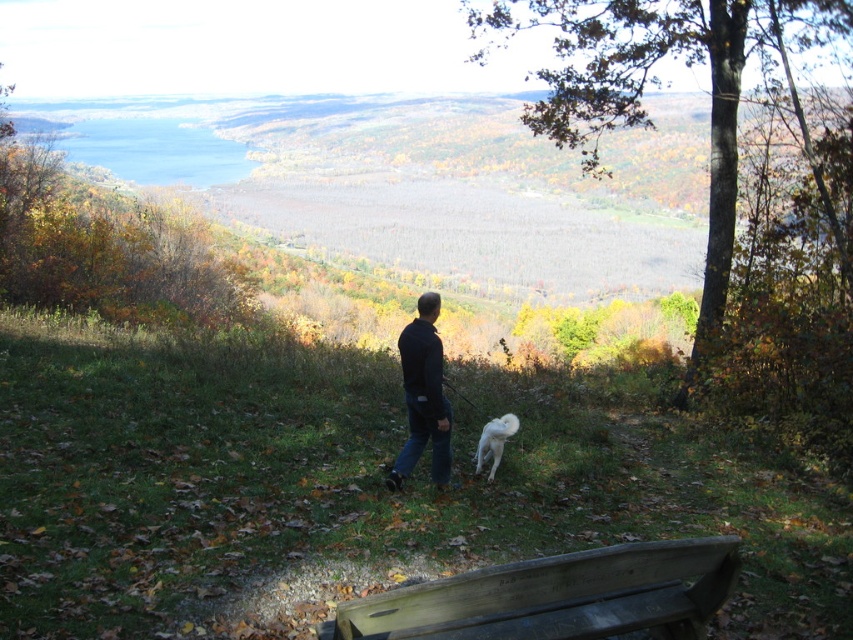
You are standing at the camera position and want to sit down on the wooden bench at lower center. What are the coordinates of the bench where you should walk to?

The coordinates of the wooden bench at lower center are at point (556, 596).

Looking at this image, you are a person who is 1.7 meters tall. You are standing at the wooden bench at lower center and want to reach the black fabric jacket at center. Can you comfortably reach it without moving from your current position?

The wooden bench at lower center and the black fabric jacket at center are 3.92 meters apart from each other. Since the distance is greater than your height, you cannot comfortably reach the jacket without moving.

You are standing at the point labeled as point (556, 596) in the image. What object are you standing on?

The point (556, 596) indicates the wooden bench at lower center, so you are standing on the wooden bench at lower center.